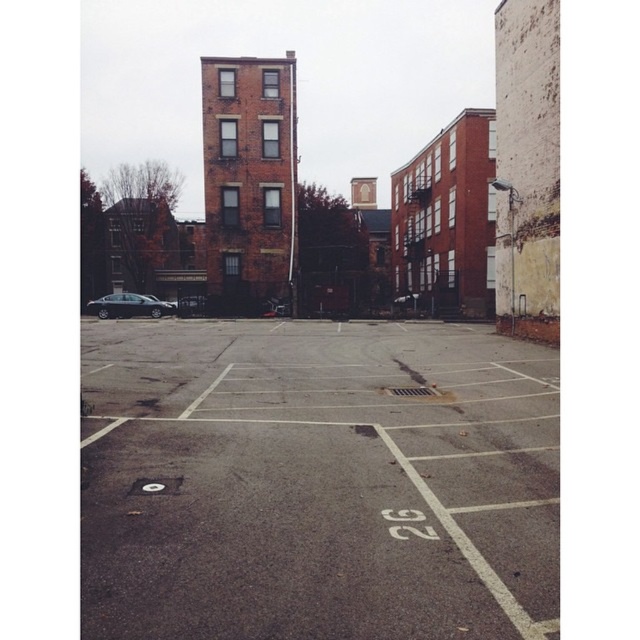
Who is lower down, gray asphalt parking lot at center or shiny black sedan at left?

gray asphalt parking lot at center is below.

Between gray asphalt parking lot at center and shiny black sedan at left, which one appears on the right side from the viewer's perspective?

gray asphalt parking lot at center is more to the right.

Where is `gray asphalt parking lot at center`? gray asphalt parking lot at center is located at coordinates (317, 481).